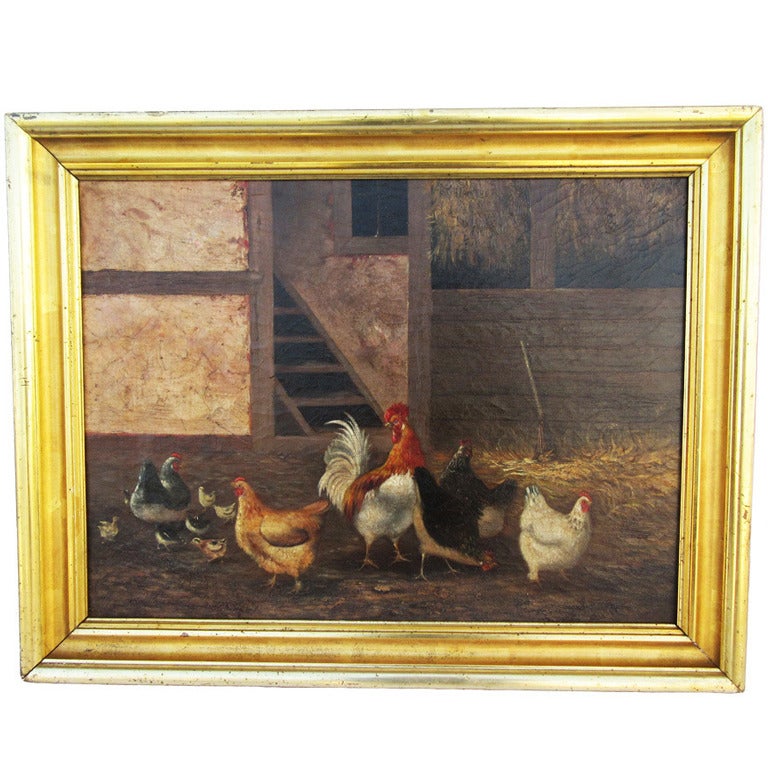
The height and width of the screenshot is (768, 768). What are the coordinates of `picture frame` in the screenshot? It's located at (723, 243).